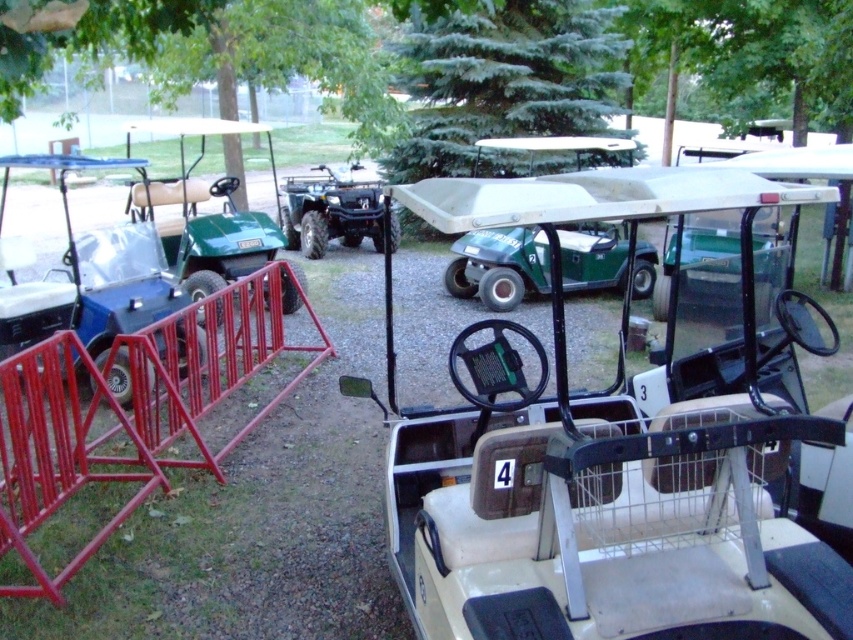
From the picture: Can you confirm if white matte golf cart at center is positioned below green matte golf cart at left?

Indeed, white matte golf cart at center is positioned under green matte golf cart at left.

Is white matte golf cart at center further to camera compared to green matte golf cart at left?

No, it is not.

The height and width of the screenshot is (640, 853). Identify the location of white matte golf cart at center. (625, 436).

What do you see at coordinates (85, 275) in the screenshot?
I see `matte black golf cart at left` at bounding box center [85, 275].

Does matte black golf cart at left have a lesser height compared to green matte golf cart at left?

Yes, matte black golf cart at left is shorter than green matte golf cart at left.

Does point (120, 300) come closer to viewer compared to point (276, 227)?

Yes.

Locate an element on the screen. The width and height of the screenshot is (853, 640). matte black golf cart at left is located at coordinates 85,275.

Can you confirm if white matte golf cart at center is shorter than matte black golf cart at left?

No, white matte golf cart at center is not shorter than matte black golf cart at left.

Find the location of a particular element. white matte golf cart at center is located at coordinates (625, 436).

Is point (775, 230) in front of point (154, 227)?

No, it is behind (154, 227).

This screenshot has height=640, width=853. In order to click on white matte golf cart at center in this screenshot , I will do `click(625, 436)`.